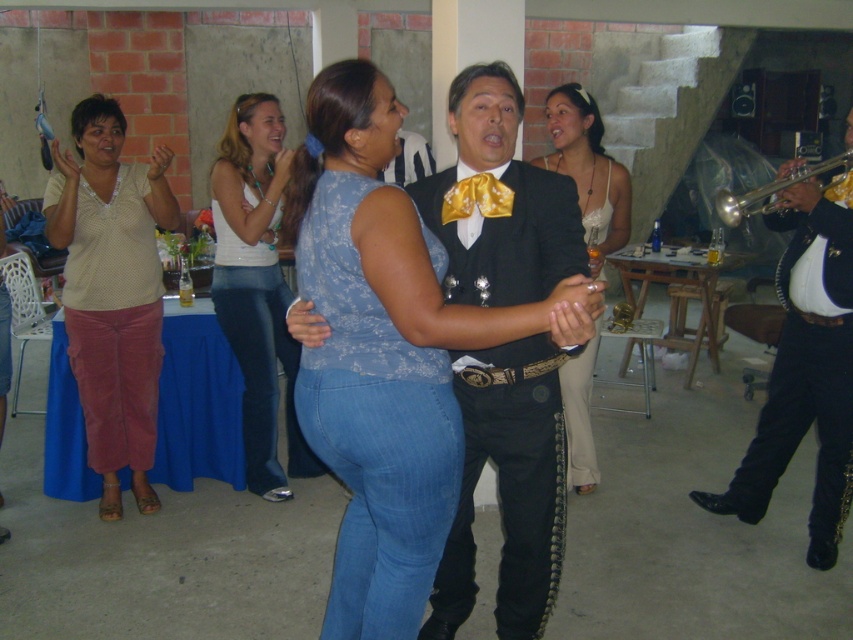
You are at a party and want to take a photo of the white lace dress at center and the gold metallic trumpet at right. Which object is positioned closer to the left side of the frame?

The white lace dress at center is positioned to the left of the gold metallic trumpet at right, so it is closer to the left side of the frame.